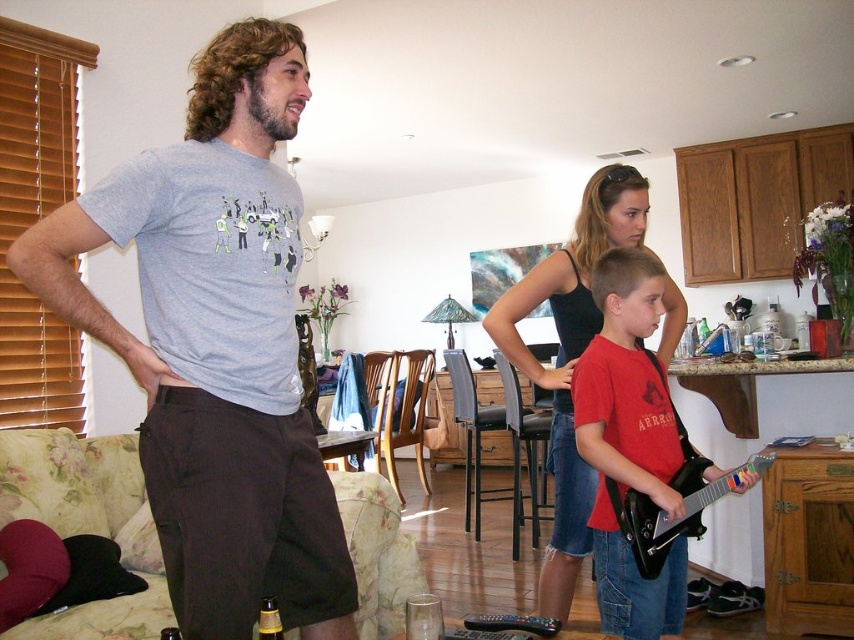
Based on the photo, can you confirm if gray t-shirt at center is taller than black tank top at center?

Incorrect, gray t-shirt at center's height is not larger of black tank top at center's.

Which of these two, gray t-shirt at center or black tank top at center, stands taller?

black tank top at center

Does point (311, 545) come behind point (640, 340)?

No, (311, 545) is in front of (640, 340).

Identify the location of gray t-shirt at center. Image resolution: width=854 pixels, height=640 pixels. (217, 344).

Is point (260, 454) more distant than point (610, 522)?

That is False.

Can you confirm if gray t-shirt at center is bigger than red matte guitar at lower right?

Indeed, gray t-shirt at center has a larger size compared to red matte guitar at lower right.

Is point (307, 506) closer to viewer compared to point (670, 500)?

That is True.

Locate an element on the screen. The image size is (854, 640). gray t-shirt at center is located at coordinates coord(217,344).

Who is more forward, (x=607, y=298) or (x=544, y=580)?

Point (x=607, y=298) is in front.

Does point (639, 316) come in front of point (582, 461)?

Yes.

Image resolution: width=854 pixels, height=640 pixels. What are the coordinates of `red matte guitar at lower right` in the screenshot? It's located at (627, 384).

Identify the location of red matte guitar at lower right. (627, 384).